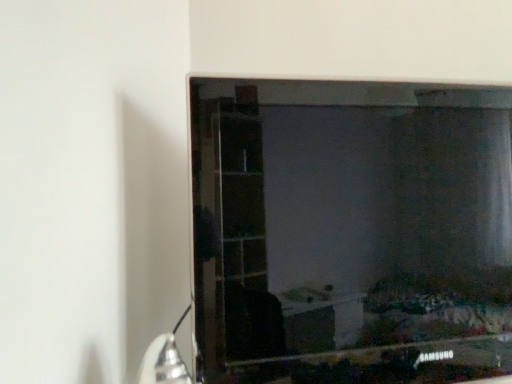
What do you see at coordinates (350, 230) in the screenshot? I see `black glossy mirror at center` at bounding box center [350, 230].

The height and width of the screenshot is (384, 512). In order to click on black glossy mirror at center in this screenshot , I will do `click(350, 230)`.

The image size is (512, 384). Identify the location of black glossy mirror at center. (350, 230).